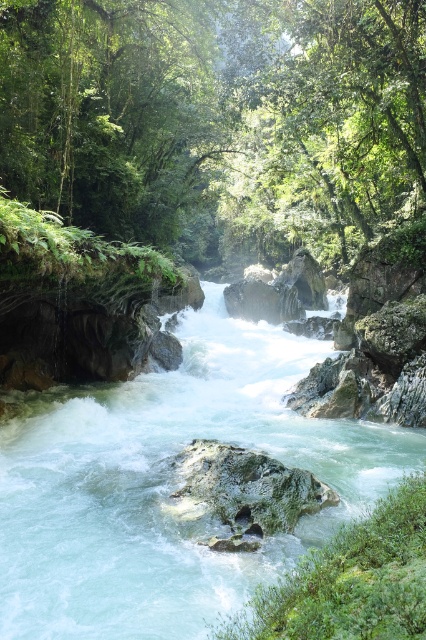
Is translucent white water at center smaller than green mossy rock at center?

No, translucent white water at center is not smaller than green mossy rock at center.

Which is above, translucent white water at center or green mossy rock at center?

translucent white water at center is higher up.

You are a GUI agent. You are given a task and a screenshot of the screen. Output one action in this format:
    pyautogui.click(x=<x>, y=<y>)
    Task: Click on the translucent white water at center
    
    Given the screenshot: What is the action you would take?
    pyautogui.click(x=169, y=484)

From the picture: Can you confirm if green leafy tree at center is positioned to the right of green mossy rock at center?

Correct, you'll find green leafy tree at center to the right of green mossy rock at center.

Describe the element at coordinates (216, 118) in the screenshot. The image size is (426, 640). I see `green leafy tree at center` at that location.

Where is `green leafy tree at center`? The width and height of the screenshot is (426, 640). green leafy tree at center is located at coordinates (216, 118).

Is green leafy tree at center positioned in front of translucent white water at center?

No, it is behind translucent white water at center.

Is point (186, 104) in front of point (57, 579)?

No, it is behind (57, 579).

Is point (241, 3) less distant than point (302, 452)?

No, it is behind (302, 452).

Locate an element on the screen. green leafy tree at center is located at coordinates (216, 118).